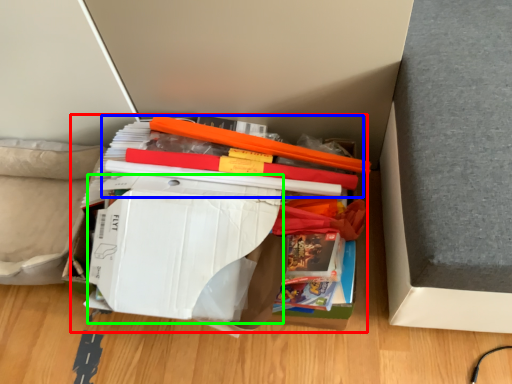
Question: Based on their relative distances, which object is farther from paperback book (highlighted by a red box)? Choose from book (highlighted by a blue box) and paperback book (highlighted by a green box).

Choices:
 (A) book
 (B) paperback book

Answer: (A)